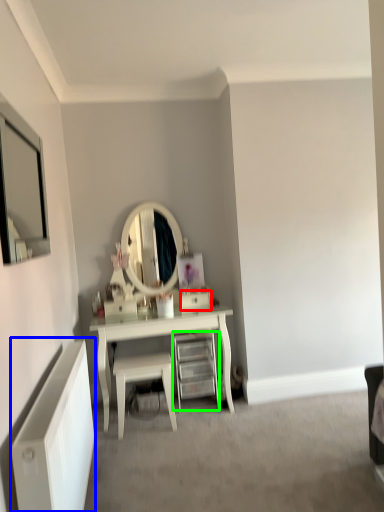
Question: Which object is positioned closest to drawer (highlighted by a red box)? Select from radiator (highlighted by a blue box) and shelf (highlighted by a green box).

Choices:
 (A) radiator
 (B) shelf

Answer: (B)